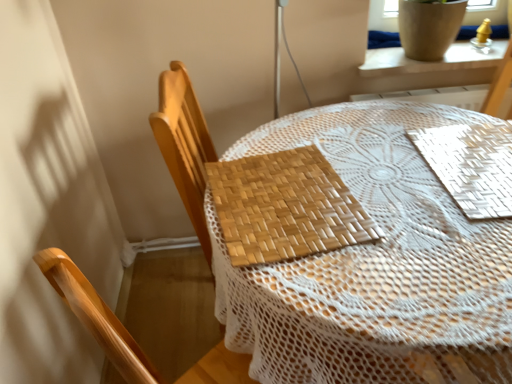
At what (x,y) coordinates should I click in order to perform the action: click on free spot behind woven wood placemat at center, the 2th mat positioned from the right. Please return your answer as a coordinate pair (x, y). The image size is (512, 384). Looking at the image, I should click on (305, 136).